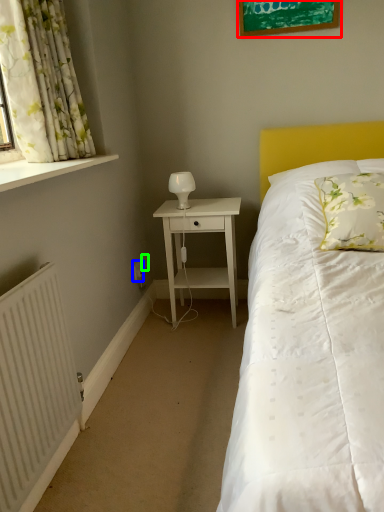
Question: Based on their relative distances, which object is farther from picture frame (highlighted by a red box)? Choose from electric outlet (highlighted by a blue box) and electric outlet (highlighted by a green box).

Choices:
 (A) electric outlet
 (B) electric outlet

Answer: (A)